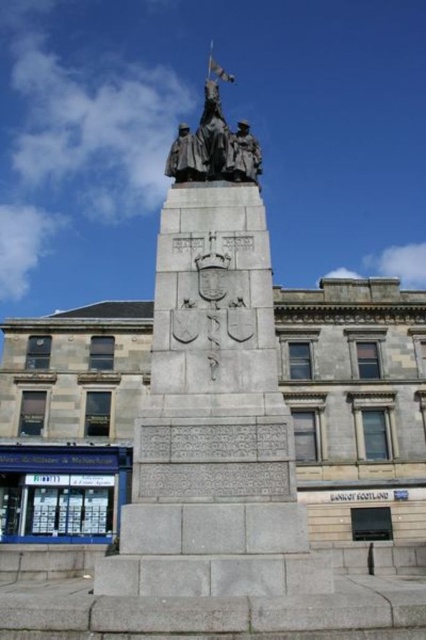
You are standing in front of the monument and want to determine the relative positions of two points marked in the image. Which point is closer to you, point (152, 436) or point (169, 156)?

Point (152, 436) is closer to the viewer than point (169, 156).